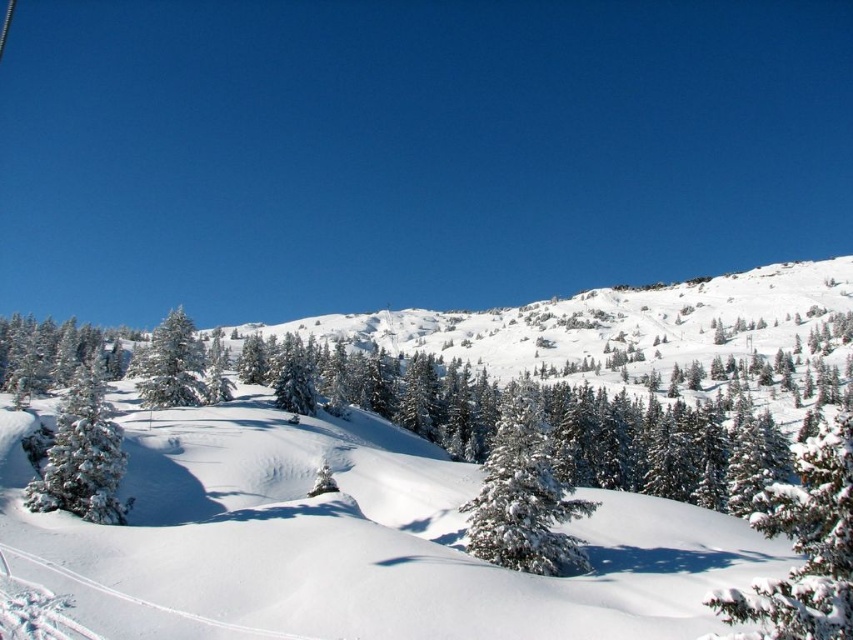
The image size is (853, 640). What do you see at coordinates (82, 456) in the screenshot? I see `white frosty tree at left` at bounding box center [82, 456].

Between white frosty tree at left and green matte tree at left, which one is positioned lower?

white frosty tree at left is lower down.

Who is more forward, (107, 508) or (194, 368)?

Point (107, 508)

Where is `white frosty tree at left`? This screenshot has height=640, width=853. white frosty tree at left is located at coordinates (82, 456).

Is white snow-covered tree at center wider than white frosty tree at left?

Incorrect, white snow-covered tree at center's width does not surpass white frosty tree at left's.

This screenshot has width=853, height=640. Identify the location of white snow-covered tree at center. (523, 497).

At what (x,y) coordinates should I click in order to perform the action: click on white snow-covered tree at center. Please return your answer as a coordinate pair (x, y). The image size is (853, 640). Looking at the image, I should click on (523, 497).

Does green textured pine at lower right appear over white snow-covered tree at center?

Incorrect, green textured pine at lower right is not positioned above white snow-covered tree at center.

Which is in front, point (804, 492) or point (492, 444)?

Point (804, 492) is more forward.

Identify the location of green textured pine at lower right. Image resolution: width=853 pixels, height=640 pixels. (804, 547).